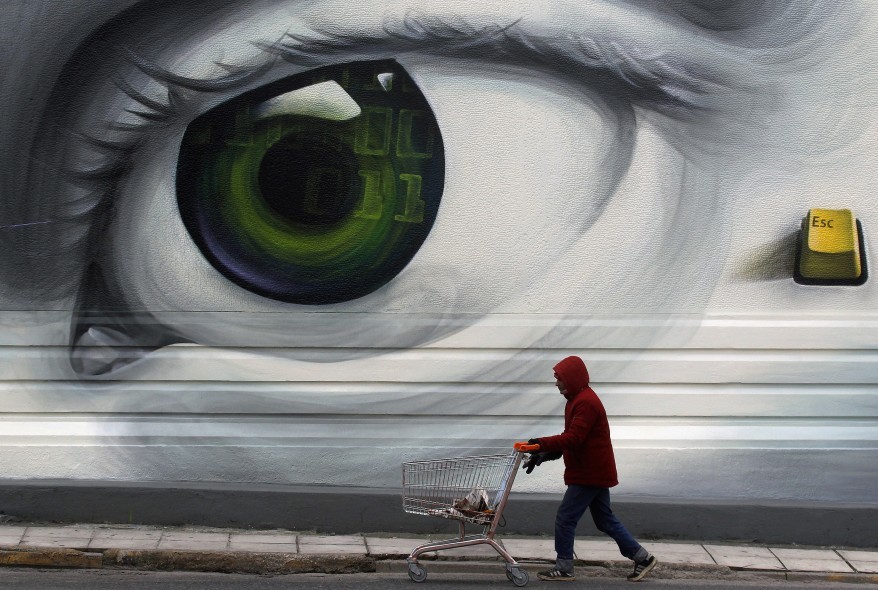
You are a GUI agent. You are given a task and a screenshot of the screen. Output one action in this format:
    pyautogui.click(x=<x>, y=<y>)
    Task: Click on the painting
    Image resolution: width=878 pixels, height=590 pixels.
    Given the screenshot: What is the action you would take?
    pyautogui.click(x=571, y=245)